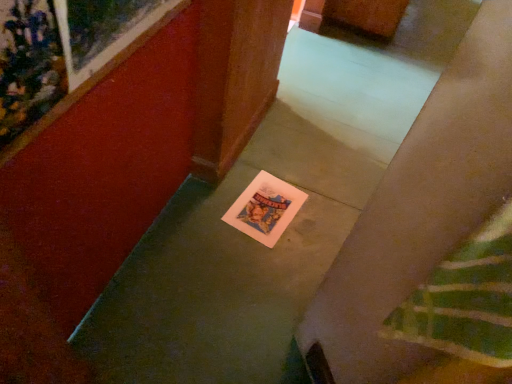
Find the location of a particular element. The image size is (512, 384). white paper postcard at center is located at coordinates (265, 208).

This screenshot has width=512, height=384. Describe the element at coordinates (265, 208) in the screenshot. I see `white paper postcard at center` at that location.

What is the approximate height of white paper postcard at center?

white paper postcard at center is 0.69 inches in height.

At what (x,y) coordinates should I click in order to perform the action: click on white paper postcard at center. Please return your answer as a coordinate pair (x, y). Looking at the image, I should click on (265, 208).